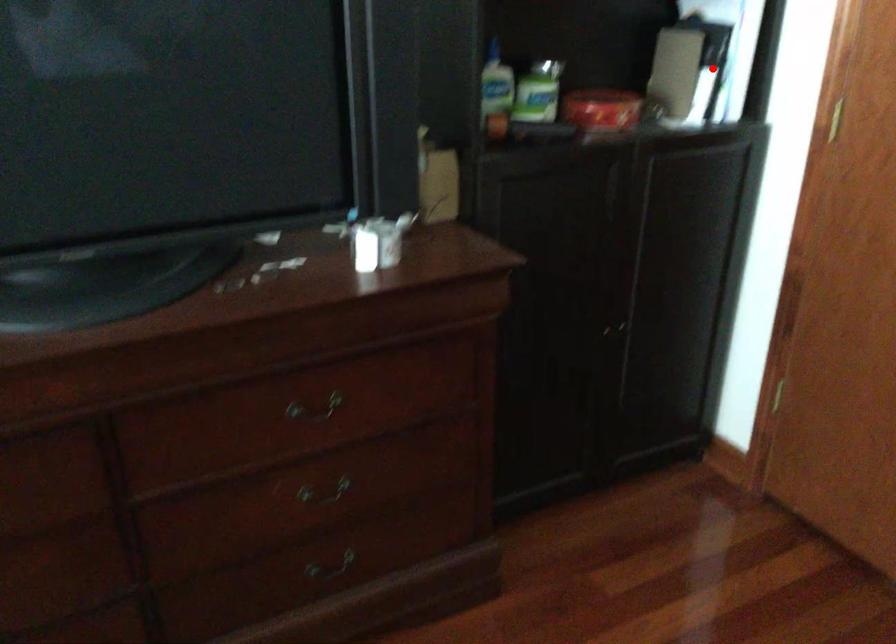
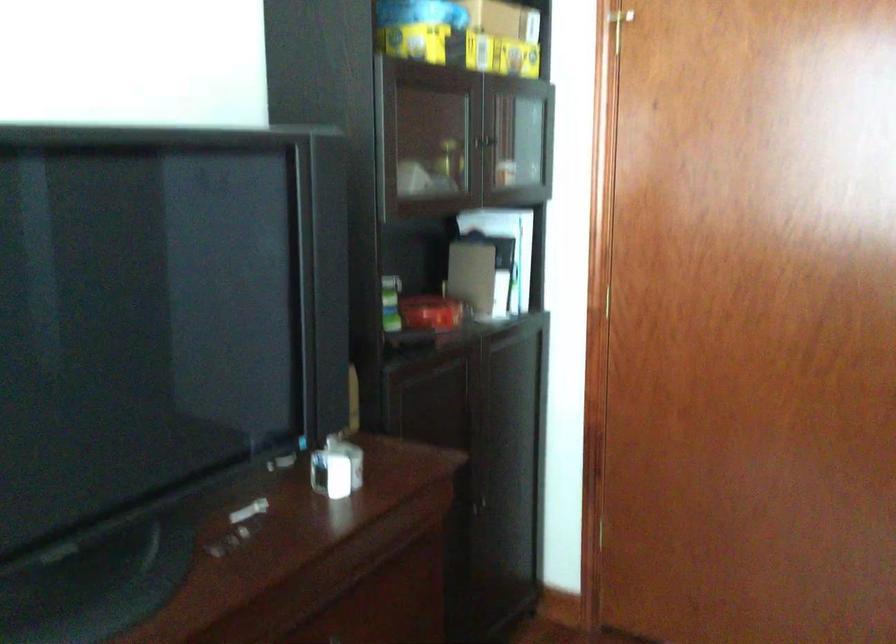
Question: I am providing you with two images of the same scene from different viewpoints. In image1, a red point is highlighted. Considering the same 3D point in image2, which of the following is correct?

Choices:
 (A) It is closer
 (B) It is farther

Answer: (B)